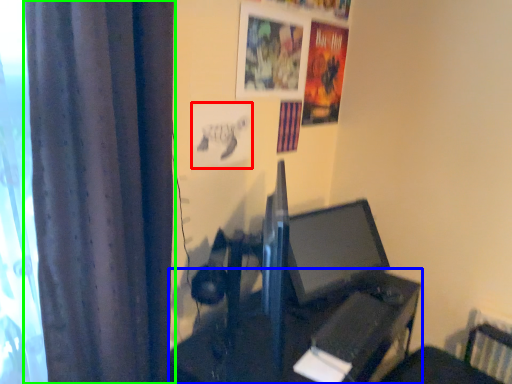
Question: Which object is positioned farthest from poster page (highlighted by a red box)? Select from table (highlighted by a blue box) and curtain (highlighted by a green box).

Choices:
 (A) table
 (B) curtain

Answer: (A)